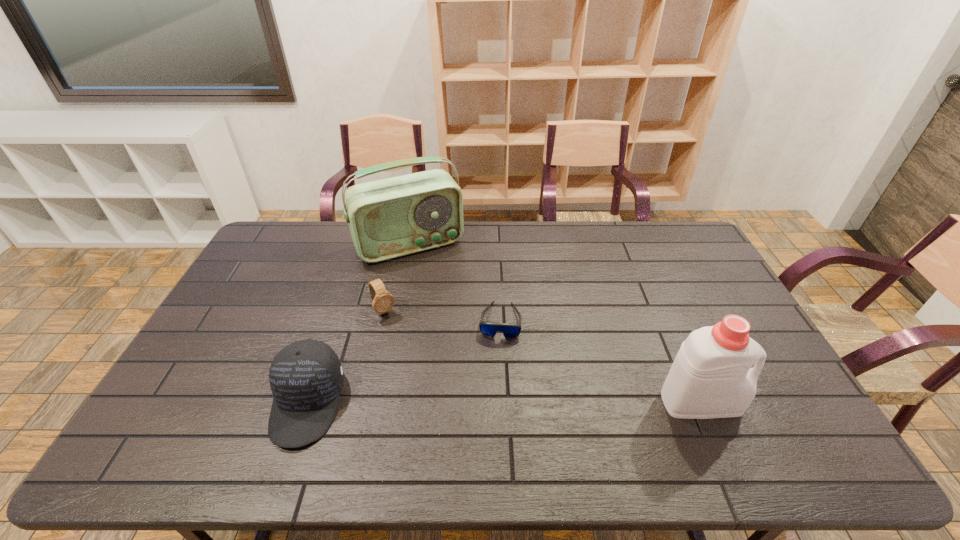
Find the location of a particular element. baseball cap is located at coordinates (306, 377).

This screenshot has width=960, height=540. I want to click on detergent, so click(x=711, y=377).

Locate an element on the screen. The image size is (960, 540). sunglasses is located at coordinates (510, 330).

This screenshot has height=540, width=960. Find the location of `the shortest object`. the shortest object is located at coordinates [x=510, y=330].

I want to click on radio receiver, so pyautogui.click(x=388, y=218).

Locate an element on the screen. This screenshot has height=540, width=960. watch is located at coordinates (382, 301).

This screenshot has width=960, height=540. I want to click on vacant area situated 0.140m on the handle side of the rightmost object, so click(792, 402).

You are a GUI agent. You are given a task and a screenshot of the screen. Output one action in this format:
    pyautogui.click(x=<x>, y=<y>)
    Task: Click on the vacant area situated 0.250m on the front-facing side of the shortest object
    This screenshot has width=960, height=540.
    Given the screenshot: What is the action you would take?
    pyautogui.click(x=492, y=416)

Locate an element on the screen. Image resolution: width=960 pixels, height=540 pixels. free point located on the front-facing side of the shortest object is located at coordinates (496, 366).

The height and width of the screenshot is (540, 960). Find the location of `vacant area situated on the front-facing side of the shortest object`. vacant area situated on the front-facing side of the shortest object is located at coordinates (495, 377).